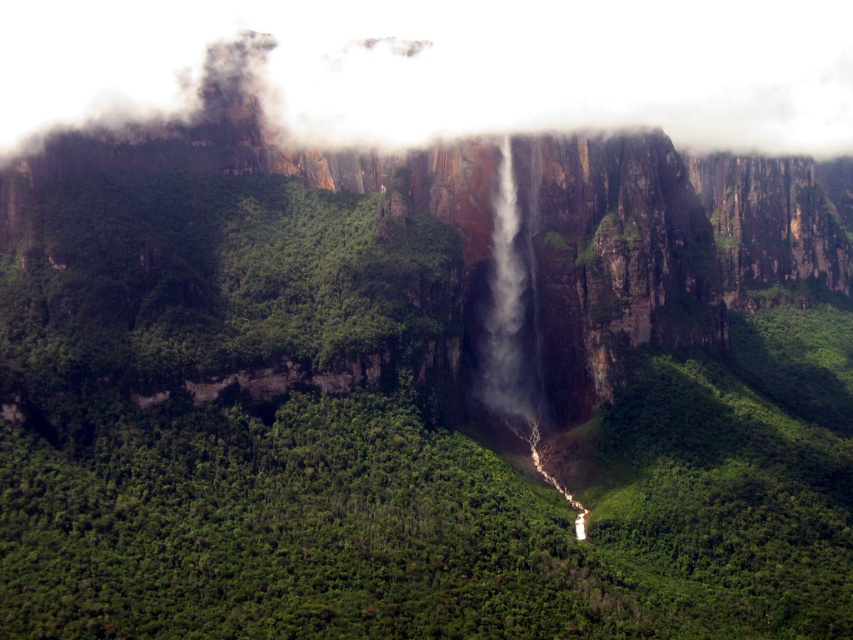
Question: Is white fog at upper center behind white misty waterfall at center?

Choices:
 (A) no
 (B) yes

Answer: (B)

Question: Which point is farther to the camera?

Choices:
 (A) white misty waterfall at center
 (B) white fog at upper center

Answer: (B)

Question: Which point appears farthest from the camera in this image?

Choices:
 (A) (509, 314)
 (B) (849, 104)

Answer: (B)

Question: Which of the following is the closest to the observer?

Choices:
 (A) (302, 51)
 (B) (531, 300)

Answer: (B)

Question: Is white fog at upper center positioned in front of white misty waterfall at center?

Choices:
 (A) yes
 (B) no

Answer: (B)

Question: In this image, where is white fog at upper center located relative to white misty waterfall at center?

Choices:
 (A) below
 (B) above

Answer: (B)